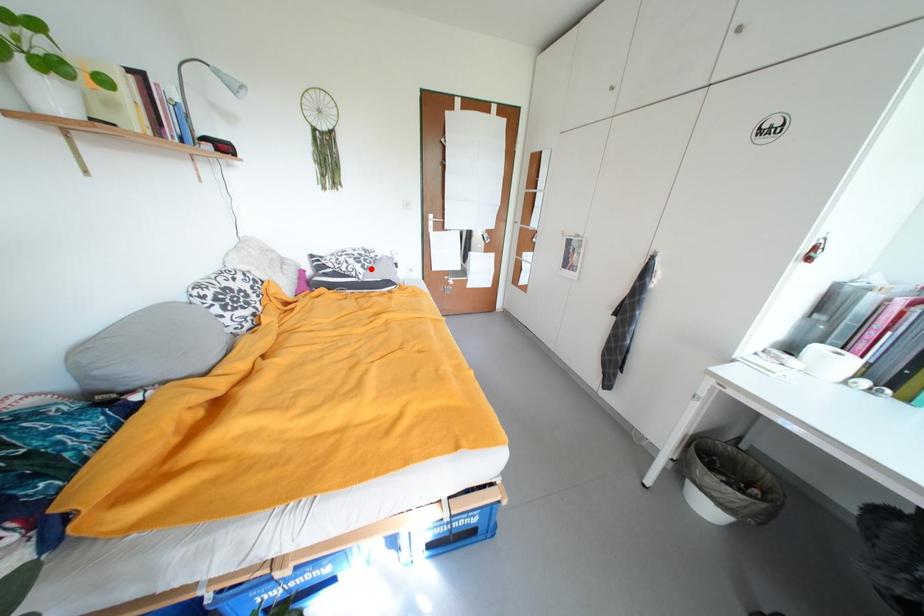
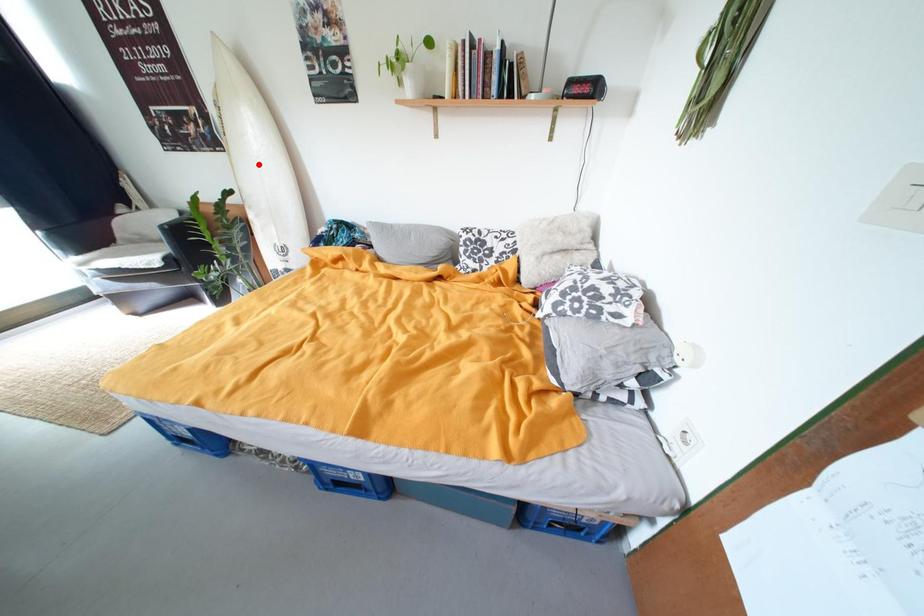
I am providing you with two images of the same scene from different viewpoints. A red point is marked on the first image and another point is marked on the second image. Do the highlighted points in image1 and image2 indicate the same real-world spot?

No